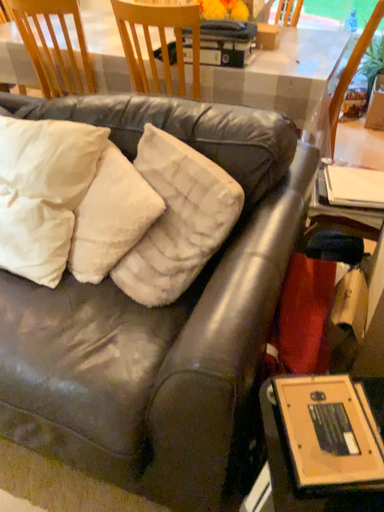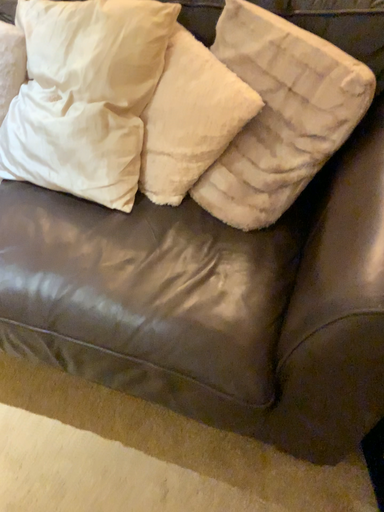
Question: How did the camera likely rotate when shooting the video?

Choices:
 (A) rotated downward
 (B) rotated upward

Answer: (A)